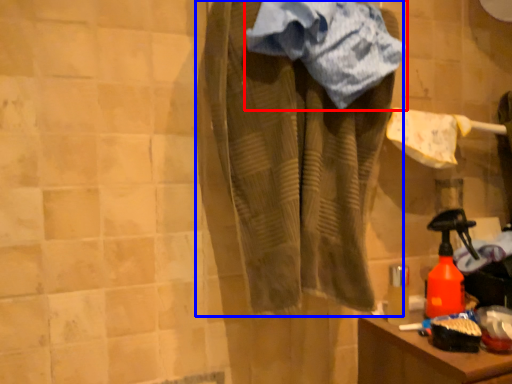
Question: Which object appears farthest to the camera in this image, towel (highlighted by a red box) or clothing (highlighted by a blue box)?

Choices:
 (A) towel
 (B) clothing

Answer: (A)